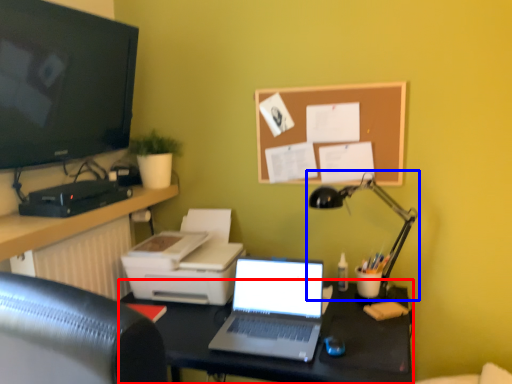
Question: Which object appears closest to the camera in this image, desk (highlighted by a red box) or lamp (highlighted by a blue box)?

Choices:
 (A) desk
 (B) lamp

Answer: (A)